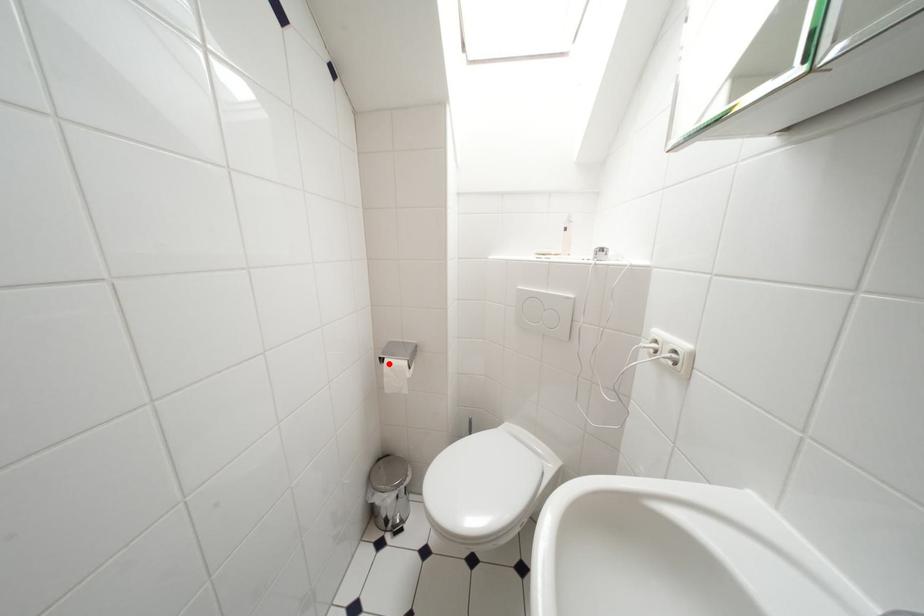
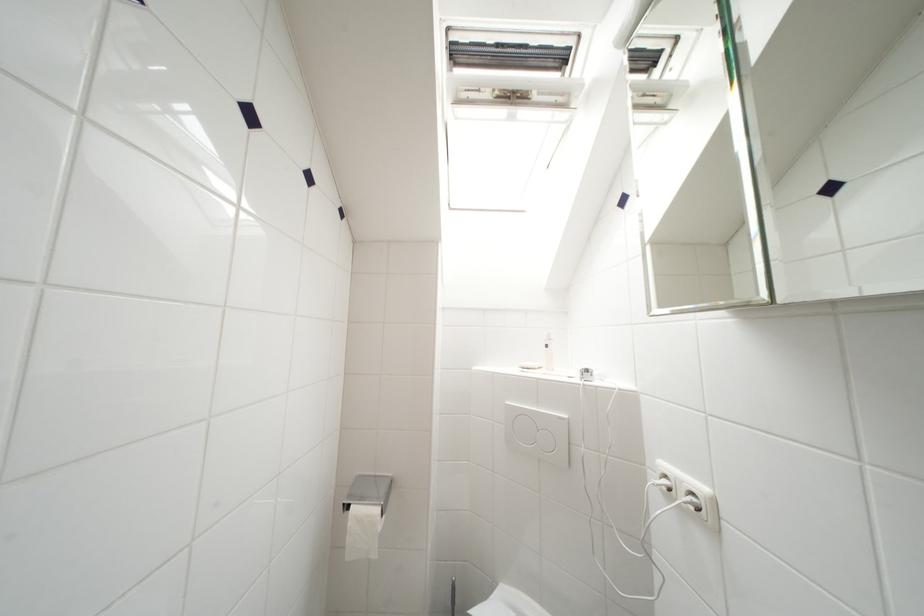
In the second image, find the point that corresponds to the highlighted location in the first image.

(354, 512)